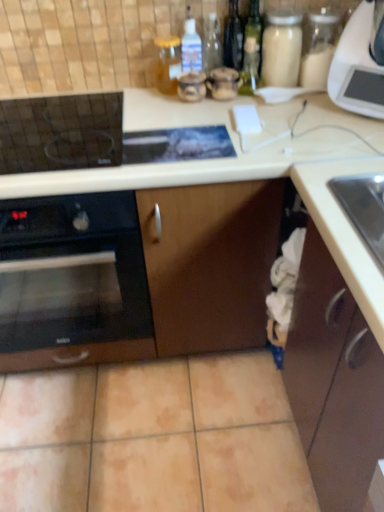
Describe the element at coordinates (72, 272) in the screenshot. I see `black glass oven at left` at that location.

Describe the element at coordinates (168, 63) in the screenshot. I see `translucent glass jar at upper center` at that location.

What is the approximate width of white plastic microwave at upper right?

13.08 inches.

This screenshot has height=512, width=384. Identify the location of black glass oven at left. (72, 272).

Locate an element on the screen. The width and height of the screenshot is (384, 512). bottle on the right of black glass oven at left is located at coordinates (168, 63).

Can we say black glass oven at left lies outside translucent glass jar at upper center?

black glass oven at left lies outside translucent glass jar at upper center's area.

Are black glass oven at left and brown matte cabinet at lower right beside each other?

black glass oven at left is not next to brown matte cabinet at lower right, and they're not touching.

Is black glass oven at left not inside brown matte cabinet at lower right?

Yes, black glass oven at left is located beyond the bounds of brown matte cabinet at lower right.

I want to click on oven behind the brown matte cabinet at lower right, so click(x=72, y=272).

From the image's perspective, is black glass oven at left beneath brown matte cabinet at lower right?

No, from the image's perspective, black glass oven at left is not below brown matte cabinet at lower right.

Are brown matte cabinet at lower right and white plastic microwave at upper right making contact?

brown matte cabinet at lower right and white plastic microwave at upper right are clearly separated.

Which is more to the left, brown matte cabinet at lower right or white plastic microwave at upper right?

brown matte cabinet at lower right.

Who is bigger, brown matte cabinet at lower right or white plastic microwave at upper right?

Bigger between the two is brown matte cabinet at lower right.

From the image's perspective, which object appears higher, brown matte cabinet at lower right or white plastic microwave at upper right?

white plastic microwave at upper right appears higher in the image.

From the image's perspective, would you say translucent glass jar at upper center is shown under white plastic microwave at upper right?

Correct, translucent glass jar at upper center appears lower than white plastic microwave at upper right in the image.

Is translucent glass jar at upper center located outside white plastic microwave at upper right?

translucent glass jar at upper center lies outside white plastic microwave at upper right's area.

Is translucent glass jar at upper center smaller than white plastic microwave at upper right?

Yes, translucent glass jar at upper center is smaller than white plastic microwave at upper right.

Where is `bottle behind the white plastic microwave at upper right`? bottle behind the white plastic microwave at upper right is located at coordinates (168, 63).

From the picture: Is black glass oven at left shorter than white plastic microwave at upper right?

In fact, black glass oven at left may be taller than white plastic microwave at upper right.

Is black glass oven at left far away from white plastic microwave at upper right?

black glass oven at left is actually quite close to white plastic microwave at upper right.

Which object is further away from the camera taking this photo, black glass oven at left or white plastic microwave at upper right?

black glass oven at left is behind.

Locate an element on the screen. The image size is (384, 512). kitchen appliance lying on the right of black glass oven at left is located at coordinates click(360, 62).

Do you think translucent glass jar at upper center is within brown matte cabinet at lower right, or outside of it?

translucent glass jar at upper center cannot be found inside brown matte cabinet at lower right.

Is translucent glass jar at upper center not close to brown matte cabinet at lower right?

No, translucent glass jar at upper center is not far from brown matte cabinet at lower right.

Who is shorter, translucent glass jar at upper center or brown matte cabinet at lower right?

With less height is translucent glass jar at upper center.

Based on the photo, could you tell me if translucent glass jar at upper center is turned towards brown matte cabinet at lower right?

No, translucent glass jar at upper center is not turned towards brown matte cabinet at lower right.

From the image's perspective, would you say white plastic microwave at upper right is positioned over translucent glass jar at upper center?

Yes, from the image's perspective, white plastic microwave at upper right is on top of translucent glass jar at upper center.

Is white plastic microwave at upper right with translucent glass jar at upper center?

No, white plastic microwave at upper right is not touching translucent glass jar at upper center.

Which is nearer, (333, 84) or (161, 55)?

Point (333, 84) is closer to the camera than point (161, 55).

Between white plastic microwave at upper right and translucent glass jar at upper center, which one is positioned behind?

Positioned behind is translucent glass jar at upper center.

This screenshot has height=512, width=384. What are the coordinates of `oven that appears below the translucent glass jar at upper center (from the image's perspective)` in the screenshot? It's located at (72, 272).

The image size is (384, 512). I want to click on cabinetry that appears below the black glass oven at left (from a real-world perspective), so click(x=333, y=381).

From the picture: Which object lies further to the anchor point black glass oven at left, white plastic microwave at upper right or brown matte cabinet at lower right?

Based on the image, white plastic microwave at upper right appears to be further to black glass oven at left.

Considering their positions, is white plastic microwave at upper right positioned further to brown matte cabinet at lower right than black glass oven at left?

white plastic microwave at upper right is positioned further to the anchor brown matte cabinet at lower right.

Looking at the image, which one is located further to translucent glass jar at upper center, black glass oven at left or white plastic microwave at upper right?

The object further to translucent glass jar at upper center is black glass oven at left.

Which object lies nearer to the anchor point brown matte cabinet at lower right, black glass oven at left or translucent glass jar at upper center?

black glass oven at left is positioned closer to the anchor brown matte cabinet at lower right.

Estimate the real-world distances between objects in this image. Which object is further from black glass oven at left, translucent glass jar at upper center or white plastic microwave at upper right?

white plastic microwave at upper right lies further to black glass oven at left than the other object.

Considering their positions, is translucent glass jar at upper center positioned closer to white plastic microwave at upper right than brown matte cabinet at lower right?

Among the two, translucent glass jar at upper center is located nearer to white plastic microwave at upper right.

Estimate the real-world distances between objects in this image. Which object is further from black glass oven at left, translucent glass jar at upper center or brown matte cabinet at lower right?

The object further to black glass oven at left is translucent glass jar at upper center.

From the image, which object appears to be nearer to white plastic microwave at upper right, black glass oven at left or translucent glass jar at upper center?

The object closer to white plastic microwave at upper right is translucent glass jar at upper center.

At what (x,y) coordinates should I click in order to perform the action: click on bottle between white plastic microwave at upper right and brown matte cabinet at lower right in the up-down direction. Please return your answer as a coordinate pair (x, y). Looking at the image, I should click on (168, 63).

Where is `bottle between black glass oven at left and brown matte cabinet at lower right`? This screenshot has height=512, width=384. bottle between black glass oven at left and brown matte cabinet at lower right is located at coordinates (168, 63).

At what (x,y) coordinates should I click in order to perform the action: click on bottle between black glass oven at left and white plastic microwave at upper right from left to right. Please return your answer as a coordinate pair (x, y). Image resolution: width=384 pixels, height=512 pixels. Looking at the image, I should click on (168, 63).

The image size is (384, 512). Identify the location of cabinetry between black glass oven at left and white plastic microwave at upper right in the horizontal direction. (333, 381).